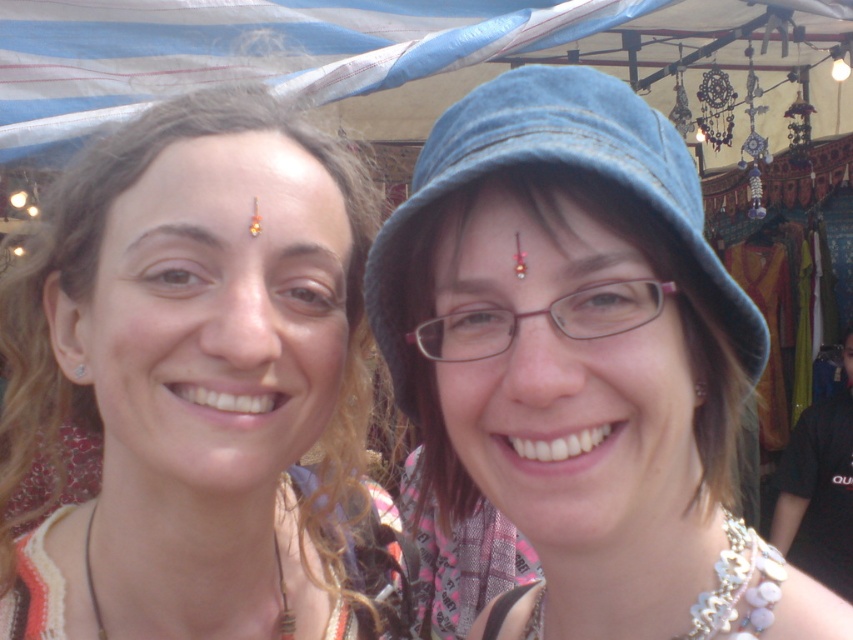
Does denim blue hat at center appear under leather cord necklace at lower left?

No, denim blue hat at center is not below leather cord necklace at lower left.

Is point (490, 129) farther from viewer compared to point (291, 618)?

No, it is in front of (291, 618).

Where is `denim blue hat at center`? The width and height of the screenshot is (853, 640). denim blue hat at center is located at coordinates (556, 164).

Which is behind, point (4, 595) or point (757, 561)?

Point (4, 595)

Does point (189, 452) lie behind point (750, 545)?

That is False.

Where is `matte black hair at center`? The width and height of the screenshot is (853, 640). matte black hair at center is located at coordinates (198, 387).

The height and width of the screenshot is (640, 853). Identify the location of matte black hair at center. (198, 387).

Does denim blue hat at center come in front of matte gold forehead at center?

Yes, it is.

Is denim blue hat at center positioned at the back of matte gold forehead at center?

No, denim blue hat at center is in front of matte gold forehead at center.

This screenshot has height=640, width=853. Describe the element at coordinates (556, 164) in the screenshot. I see `denim blue hat at center` at that location.

Identify the location of denim blue hat at center. (556, 164).